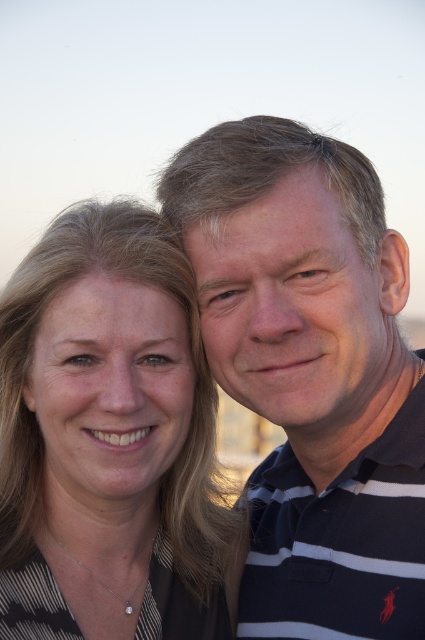
Which is more to the left, matte striped polo shirt at center or dark blue striped polo shirt at right?

matte striped polo shirt at center

Between matte striped polo shirt at center and dark blue striped polo shirt at right, which one is positioned lower?

dark blue striped polo shirt at right

This screenshot has width=425, height=640. Describe the element at coordinates (311, 372) in the screenshot. I see `matte striped polo shirt at center` at that location.

Image resolution: width=425 pixels, height=640 pixels. I want to click on matte striped polo shirt at center, so click(311, 372).

In the scene shown: Can you confirm if matte striped polo shirt at center is positioned to the right of matte black shirt at left?

Indeed, matte striped polo shirt at center is positioned on the right side of matte black shirt at left.

Is point (340, 182) positioned before point (99, 515)?

Yes, it is.

Image resolution: width=425 pixels, height=640 pixels. I want to click on matte striped polo shirt at center, so click(311, 372).

Can you confirm if matte black shirt at left is positioned below dark blue striped polo shirt at right?

Indeed, matte black shirt at left is positioned under dark blue striped polo shirt at right.

Is matte black shirt at left thinner than dark blue striped polo shirt at right?

Indeed, matte black shirt at left has a lesser width compared to dark blue striped polo shirt at right.

Locate an element on the screen. This screenshot has height=640, width=425. matte black shirt at left is located at coordinates (110, 440).